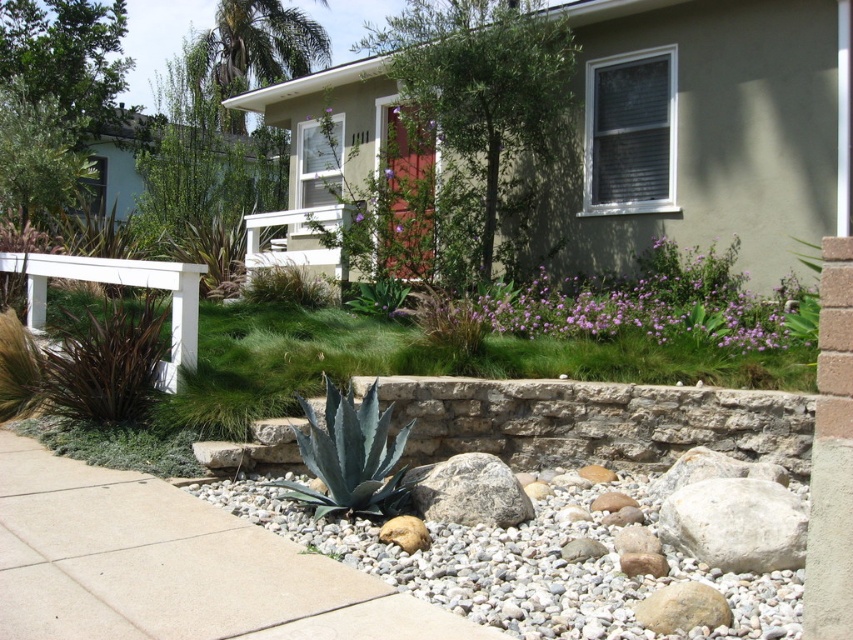
Which is in front, point (320, 580) or point (387, 339)?

Point (320, 580) is more forward.

Is white concrete path at center shorter than green grass at center?

Yes.

What do you see at coordinates (173, 566) in the screenshot? I see `white concrete path at center` at bounding box center [173, 566].

This screenshot has width=853, height=640. Identify the location of white concrete path at center. click(x=173, y=566).

Is purple matte flowers at center further to the viewer compared to white smooth rock at lower right?

Yes, purple matte flowers at center is further from the viewer.

Can you confirm if purple matte flowers at center is thinner than white smooth rock at lower right?

No.

Is point (607, 280) closer to camera compared to point (689, 554)?

No, (607, 280) is behind (689, 554).

At what (x,y) coordinates should I click in order to perform the action: click on purple matte flowers at center. Please return your answer as a coordinate pair (x, y). Image resolution: width=853 pixels, height=640 pixels. Looking at the image, I should click on (659, 304).

Is point (265, 308) farther from camera compared to point (357, 216)?

No, it is in front of (357, 216).

Does green grass at center appear on the right side of purple matte flower at center?

Indeed, green grass at center is positioned on the right side of purple matte flower at center.

The image size is (853, 640). I want to click on green grass at center, so click(x=424, y=362).